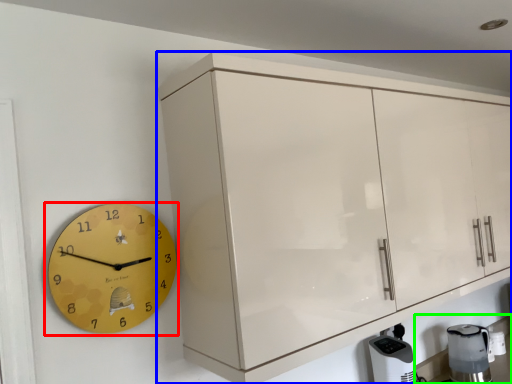
Question: Which object is positioned farthest from wall clock (highlighted by a red box)? Select from cabinetry (highlighted by a blue box) and counter top (highlighted by a green box).

Choices:
 (A) cabinetry
 (B) counter top

Answer: (B)